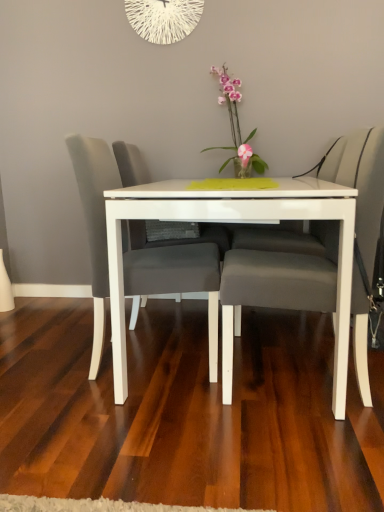
In order to click on vacant space in front of matte gray chair at center, the first chair positioned from the left in this screenshot , I will do `click(131, 429)`.